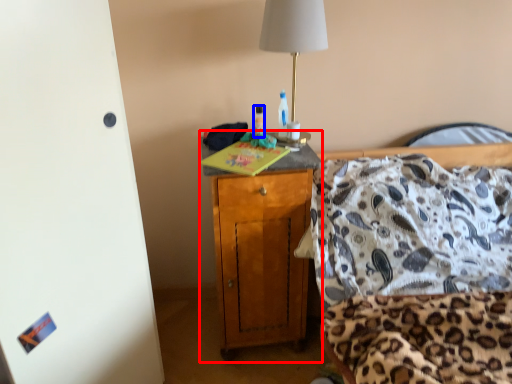
Question: Which of the following is the farthest to the observer, cabinetry (highlighted by a red box) or bottle (highlighted by a blue box)?

Choices:
 (A) cabinetry
 (B) bottle

Answer: (B)